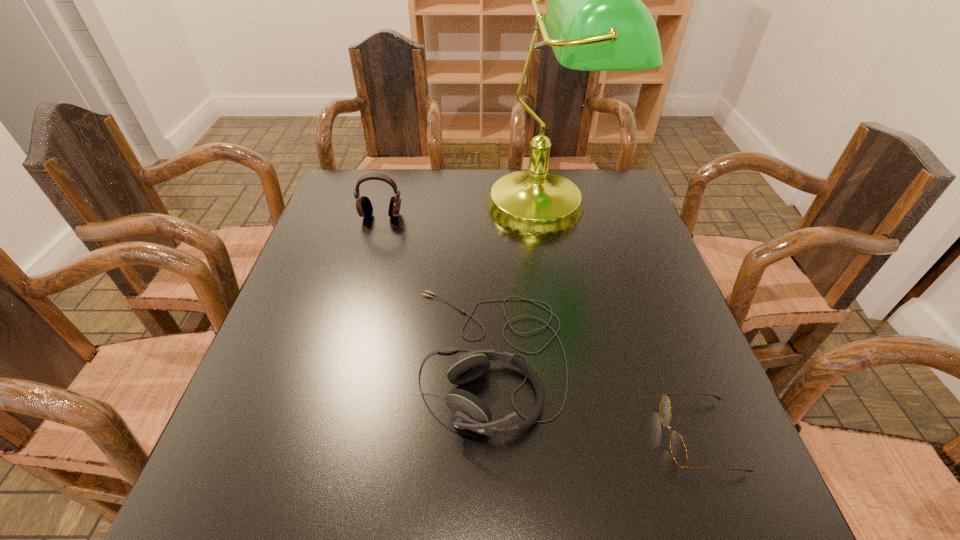
Where is `object identified as the second closest to the second tallest object`? object identified as the second closest to the second tallest object is located at coordinates (470, 412).

Locate an element on the screen. object identified as the third closest to the nearer headset is located at coordinates (364, 207).

The height and width of the screenshot is (540, 960). What are the coordinates of `vacant area that satisfies the following two spatial constraints: 1. on the desk next to the lamp; 2. on the outer surface of the nearer headset` in the screenshot? It's located at (576, 358).

At what (x,y) coordinates should I click in order to perform the action: click on vacant region that satisfies the following two spatial constraints: 1. on the desk next to the tallest object; 2. on the outer surface of the shorter headset. Please return your answer as a coordinate pair (x, y). Image resolution: width=960 pixels, height=540 pixels. Looking at the image, I should click on (576, 358).

I want to click on free space that satisfies the following two spatial constraints: 1. on the desk next to the lamp; 2. on the outer surface of the shorter headset, so click(x=576, y=358).

Where is `vacant space that satisfies the following two spatial constraints: 1. on the desk next to the tallest object; 2. on the outer surface of the nearer headset`? vacant space that satisfies the following two spatial constraints: 1. on the desk next to the tallest object; 2. on the outer surface of the nearer headset is located at coordinates (576, 358).